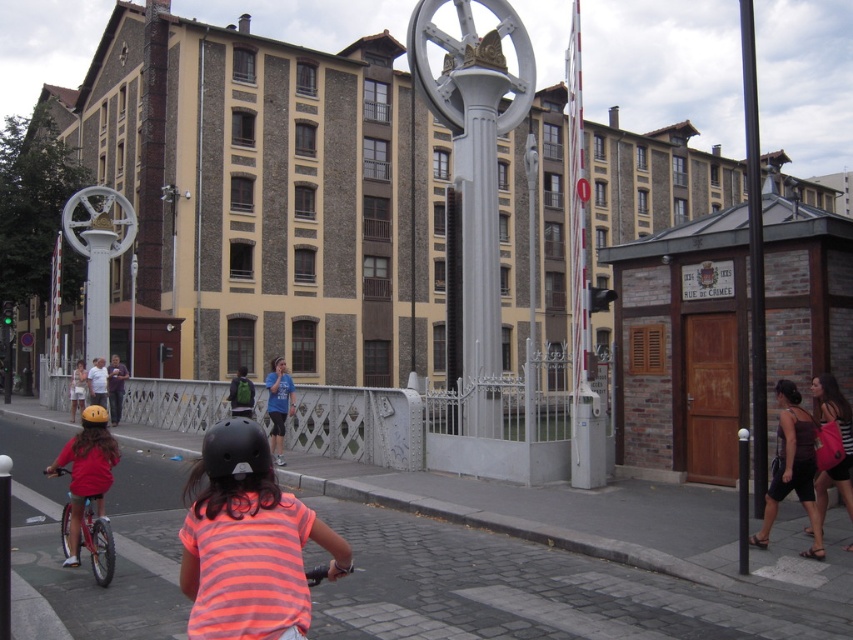
Between blue t-shirt at center and green backpack at center, which one appears on the right side from the viewer's perspective?

→ blue t-shirt at center

Who is higher up, blue t-shirt at center or green backpack at center?

Positioned higher is blue t-shirt at center.

Is point (270, 401) farther from viewer compared to point (241, 413)?

No, (270, 401) is closer to viewer.

Locate an element on the screen. The width and height of the screenshot is (853, 640). blue t-shirt at center is located at coordinates (277, 404).

Which is below, silver metallic bicycle at left or light blue shirt at center?

light blue shirt at center

Is silver metallic bicycle at left to the right of light blue shirt at center from the viewer's perspective?

Yes, silver metallic bicycle at left is to the right of light blue shirt at center.

You are a GUI agent. You are given a task and a screenshot of the screen. Output one action in this format:
    pyautogui.click(x=<x>, y=<y>)
    Task: Click on the silver metallic bicycle at left
    Image resolution: width=853 pixels, height=640 pixels.
    Given the screenshot: What is the action you would take?
    pyautogui.click(x=97, y=541)

Between point (250, 464) and point (88, 419), which one is positioned behind?

The point (88, 419) is more distant.

Does black matte helmet at center appear over orange matte bicycle helmet at rear?

Correct, black matte helmet at center is located above orange matte bicycle helmet at rear.

I want to click on black matte helmet at center, so click(x=235, y=449).